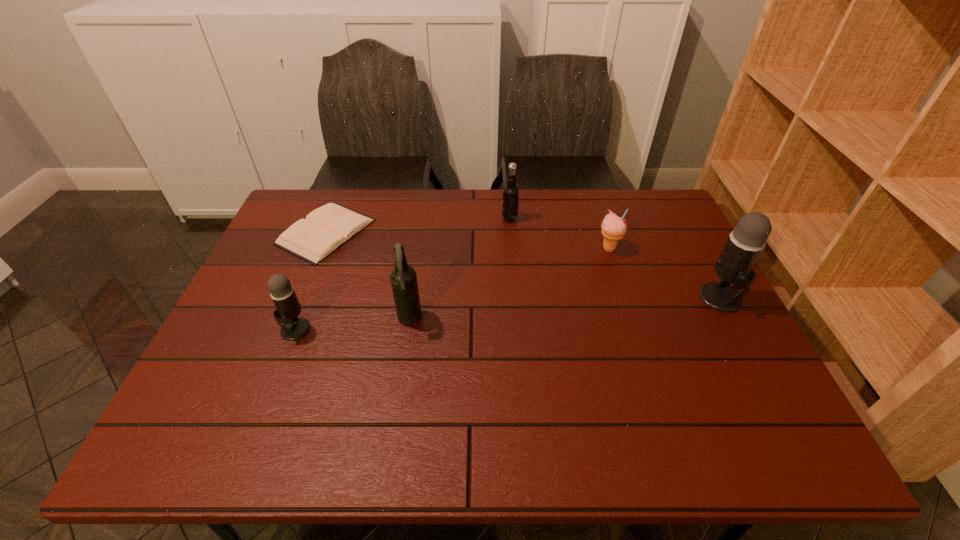
Locate an element on the screen. Image resolution: width=960 pixels, height=540 pixels. blank area located on the left of the right microphone is located at coordinates (666, 298).

Where is `vacant space located on the right of the hardback book`? vacant space located on the right of the hardback book is located at coordinates (463, 232).

At what (x,y) coordinates should I click in order to perform the action: click on vacant area located on the back of the second shortest object. Please return your answer as a coordinate pair (x, y). Looking at the image, I should click on (601, 222).

Find the location of a particular element. Image resolution: width=960 pixels, height=540 pixels. vacant space located on the label of the root beer is located at coordinates point(418,219).

Identify the location of blank area located on the label of the root beer. This screenshot has width=960, height=540. (377, 219).

Where is `free space located on the label of the root beer`? free space located on the label of the root beer is located at coordinates (465, 219).

Where is `vacant area situated 0.290m on the left of the third object from left to right`? The image size is (960, 540). vacant area situated 0.290m on the left of the third object from left to right is located at coordinates (282, 320).

I want to click on hardback book at the far edge, so click(x=327, y=228).

I want to click on root beer that is at the far edge, so click(x=511, y=192).

The width and height of the screenshot is (960, 540). I want to click on microphone that is at the left edge, so click(x=288, y=308).